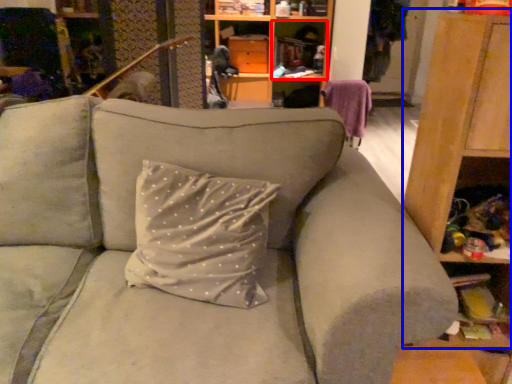
Question: Which point is further to the camera, cabinet (highlighted by a red box) or dresser (highlighted by a blue box)?

Choices:
 (A) cabinet
 (B) dresser

Answer: (A)